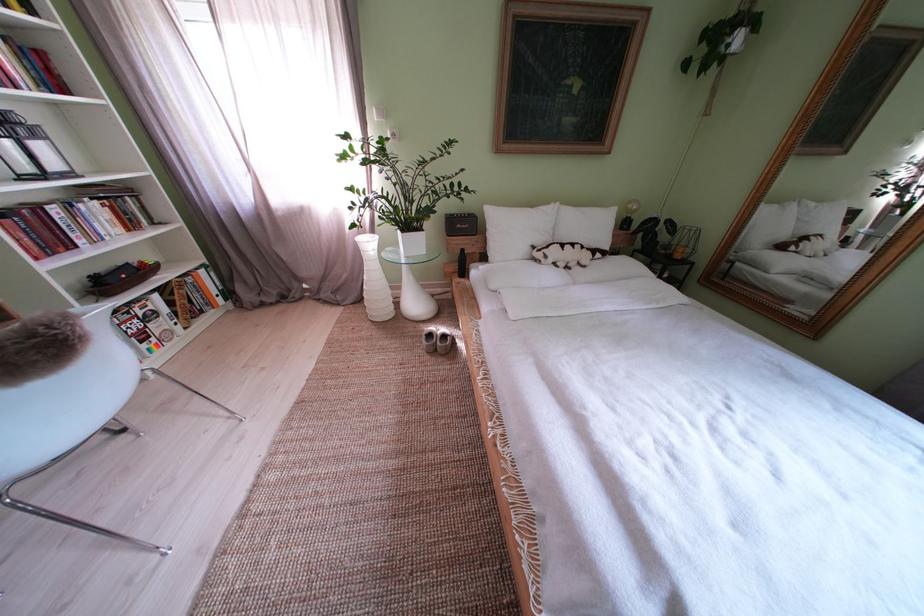
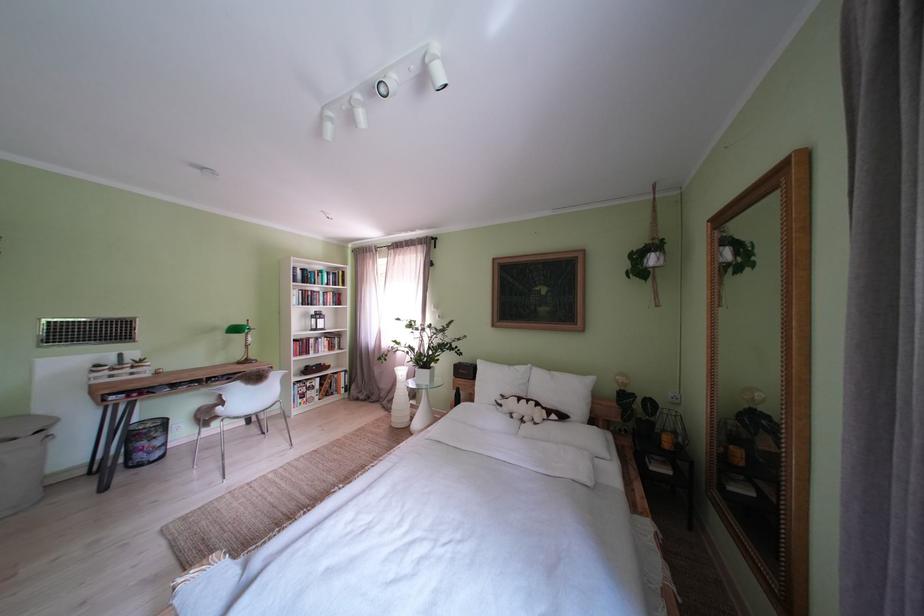
Find the pixel in the second image that matches (464,220) in the first image.

(472, 369)